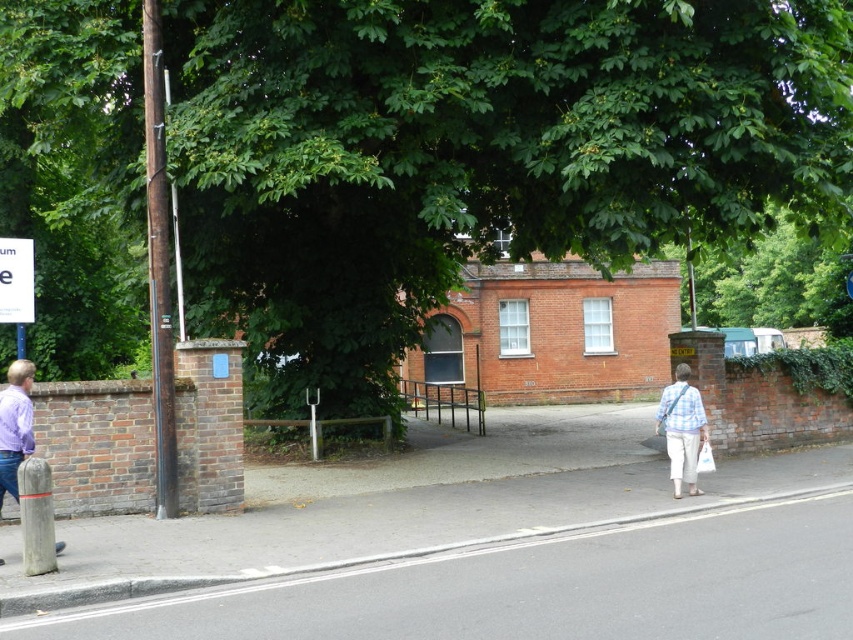
What do you see at coordinates (477, 152) in the screenshot?
I see `green leafy tree at upper center` at bounding box center [477, 152].

Which is more to the left, green leafy tree at upper center or white plastic sign at upper left?

Positioned to the left is white plastic sign at upper left.

What do you see at coordinates (477, 152) in the screenshot? I see `green leafy tree at upper center` at bounding box center [477, 152].

Locate an element on the screen. green leafy tree at upper center is located at coordinates [477, 152].

From the picture: Can you confirm if gray concrete pavement at lower center is positioned below purple matte shirt at left?

Yes.

Is gray concrete pavement at lower center shorter than purple matte shirt at left?

Yes, gray concrete pavement at lower center is shorter than purple matte shirt at left.

Which is in front, point (440, 577) or point (21, 378)?

Positioned in front is point (440, 577).

What are the coordinates of `gray concrete pavement at lower center` in the screenshot? It's located at (537, 588).

Can you confirm if plaid shirt and pants at lower right is positioned above purple matte shirt at left?

Actually, plaid shirt and pants at lower right is below purple matte shirt at left.

Which is in front, point (680, 403) or point (4, 388)?

Point (4, 388) is in front.

I want to click on plaid shirt and pants at lower right, so click(682, 429).

Where is `plaid shirt and pants at lower right`? Image resolution: width=853 pixels, height=640 pixels. plaid shirt and pants at lower right is located at coordinates (682, 429).